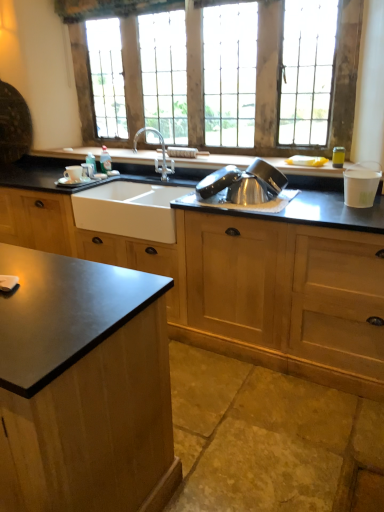
Question: Is white matte sink at center not inside white paper cup at right, which is counted as the 1th appliance, starting from the right?

Choices:
 (A) no
 (B) yes

Answer: (B)

Question: Is white matte sink at center closer to camera compared to white paper cup at right, which is counted as the 1th appliance, starting from the right?

Choices:
 (A) yes
 (B) no

Answer: (B)

Question: Does white matte sink at center appear on the right side of white paper cup at right, which is counted as the 2th appliance, starting from the left?

Choices:
 (A) no
 (B) yes

Answer: (A)

Question: Considering the relative sizes of white matte sink at center and white paper cup at right, which is counted as the 1th appliance, starting from the right, in the image provided, is white matte sink at center thinner than white paper cup at right, which is counted as the 1th appliance, starting from the right,?

Choices:
 (A) no
 (B) yes

Answer: (A)

Question: From the image's perspective, is white matte sink at center below white paper cup at right, which is counted as the 1th appliance, starting from the right?

Choices:
 (A) yes
 (B) no

Answer: (A)

Question: In terms of height, does matte white cup at sink look taller or shorter compared to silver metallic faucet at center?

Choices:
 (A) short
 (B) tall

Answer: (A)

Question: Is point (66, 176) positioned closer to the camera than point (162, 146)?

Choices:
 (A) farther
 (B) closer

Answer: (B)

Question: In terms of size, does matte white cup at sink appear bigger or smaller than silver metallic faucet at center?

Choices:
 (A) small
 (B) big

Answer: (A)

Question: Choose the correct answer: Is matte white cup at sink inside silver metallic faucet at center or outside it?

Choices:
 (A) inside
 (B) outside

Answer: (B)

Question: Looking at their shapes, would you say silver metallic faucet at center is wider or thinner than clear plastic bottle at sink left?

Choices:
 (A) wide
 (B) thin

Answer: (A)

Question: Is silver metallic faucet at center taller or shorter than clear plastic bottle at sink left?

Choices:
 (A) short
 (B) tall

Answer: (B)

Question: Is point (155, 159) positioned closer to the camera than point (104, 162)?

Choices:
 (A) farther
 (B) closer

Answer: (A)

Question: Would you say silver metallic faucet at center is inside or outside clear plastic bottle at sink left?

Choices:
 (A) inside
 (B) outside

Answer: (B)

Question: Is wooden window at upper center taller or shorter than matte white cup at sink?

Choices:
 (A) short
 (B) tall

Answer: (B)

Question: Is wooden window at upper center bigger or smaller than matte white cup at sink?

Choices:
 (A) big
 (B) small

Answer: (A)